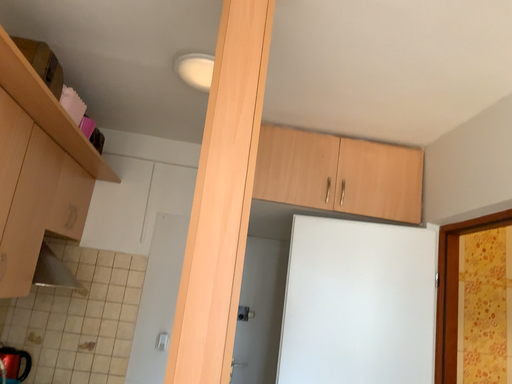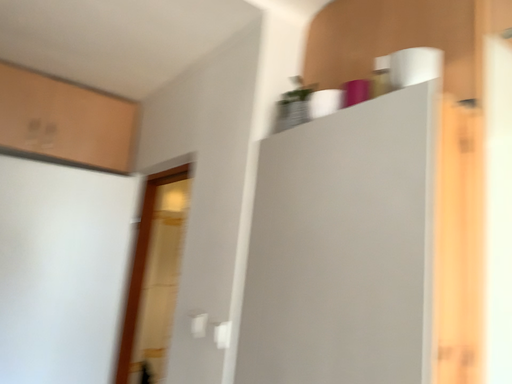
Question: Which way did the camera rotate in the video?

Choices:
 (A) rotated downward
 (B) rotated upward

Answer: (A)